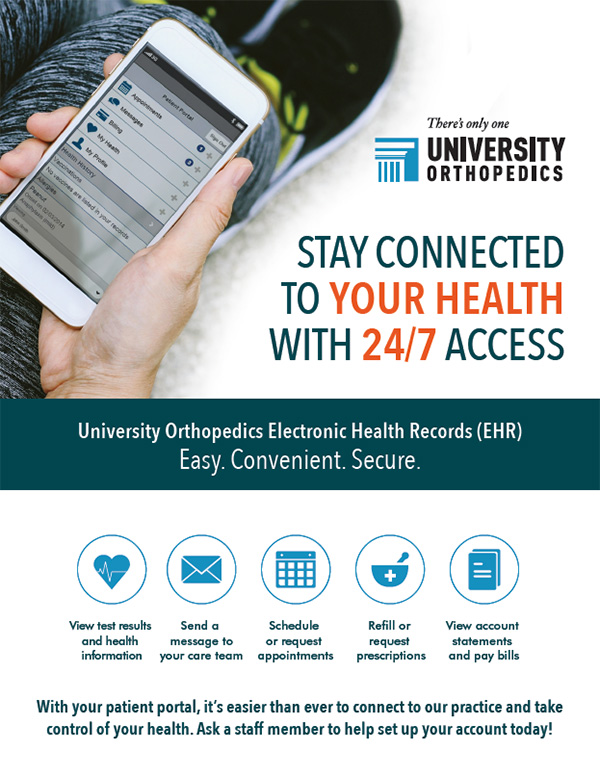
You are a GUI agent. You are given a task and a screenshot of the screen. Output one action in this format:
    pyautogui.click(x=<x>, y=<y>)
    Task: Click on the calendar
    
    Given the screenshot: What is the action you would take?
    pyautogui.click(x=285, y=562)